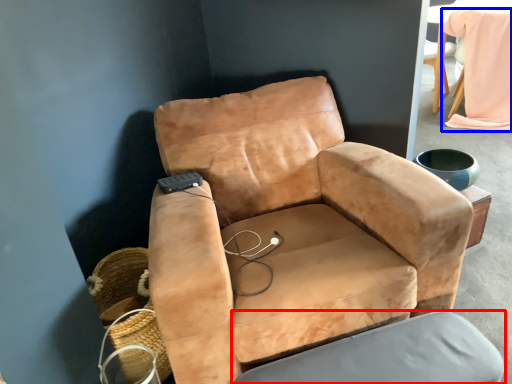
Question: Among these objects, which one is nearest to the camera, swivel chair (highlighted by a red box) or bean bag chair (highlighted by a blue box)?

Choices:
 (A) swivel chair
 (B) bean bag chair

Answer: (A)